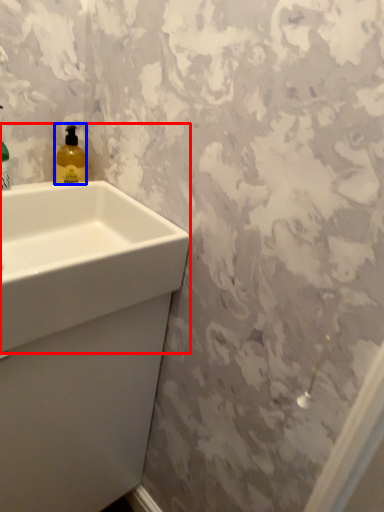
Question: Which of the following is the farthest to the observer, sink (highlighted by a red box) or soap dispenser (highlighted by a blue box)?

Choices:
 (A) sink
 (B) soap dispenser

Answer: (B)